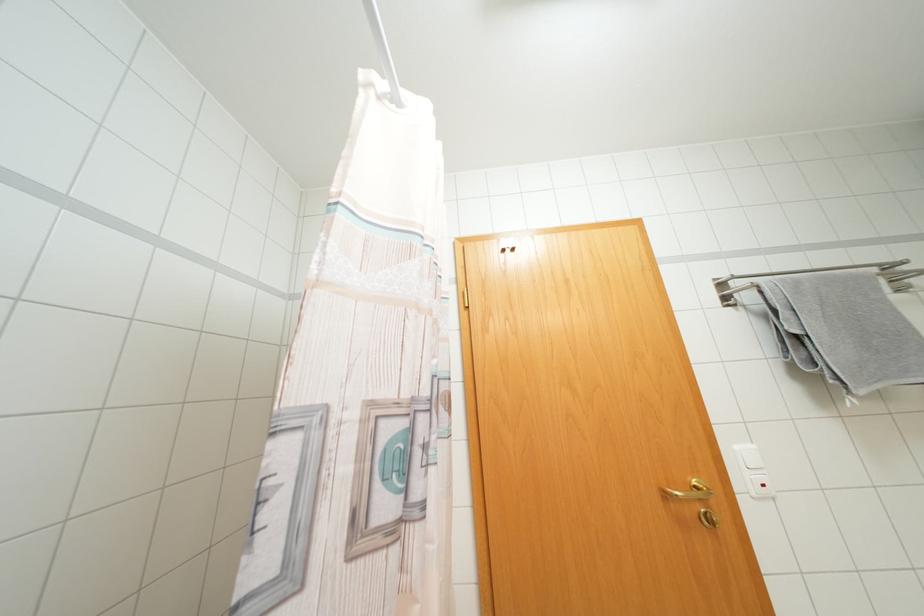
Find the location of a particular element. Image resolution: width=924 pixels, height=616 pixels. gray towel is located at coordinates (844, 329).